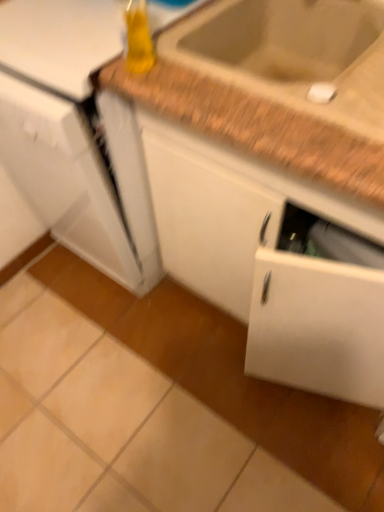
What is the approximate height of white glossy refrigerator at left?

white glossy refrigerator at left is 33.90 inches tall.

Describe the element at coordinates (76, 137) in the screenshot. I see `white glossy refrigerator at left` at that location.

The image size is (384, 512). What are the coordinates of `white glossy refrigerator at left` in the screenshot? It's located at (76, 137).

The width and height of the screenshot is (384, 512). What are the coordinates of `cabinetry located below the translucent yellow bottle at upper center (from the image's perspective)` in the screenshot? It's located at (268, 265).

Can you confirm if translucent yellow bottle at upper center is shorter than white matte cabinet at center?

Yes.

Is there a large distance between translucent yellow bottle at upper center and white matte cabinet at center?

No, there isn't a large distance between translucent yellow bottle at upper center and white matte cabinet at center.

Is brown speckled granite at upper right wider or thinner than white matte cabinet at center?

brown speckled granite at upper right is thinner than white matte cabinet at center.

Is brown speckled granite at upper right facing towards white matte cabinet at center?

Yes.

What are the coordinates of `cabinetry on the right of brown speckled granite at upper right` in the screenshot? It's located at (268, 265).

Is brown speckled granite at upper right in front of or behind white glossy refrigerator at left in the image?

In the image, brown speckled granite at upper right appears in front of white glossy refrigerator at left.

Which is more to the left, brown speckled granite at upper right or white glossy refrigerator at left?

Positioned to the left is white glossy refrigerator at left.

Does point (265, 5) lie in front of point (40, 179)?

That is True.

Identify the location of countertop that is in front of the white glossy refrigerator at left. (277, 86).

From the image's perspective, does white matte cabinet at center appear higher than translucent yellow bottle at upper center?

No.

From a real-world perspective, who is located higher, white matte cabinet at center or translucent yellow bottle at upper center?

translucent yellow bottle at upper center is physically above.

Looking at this image, does white matte cabinet at center appear on the right side of translucent yellow bottle at upper center?

Correct, you'll find white matte cabinet at center to the right of translucent yellow bottle at upper center.

Does white glossy refrigerator at left have a smaller size compared to brown speckled granite at upper right?

Incorrect, white glossy refrigerator at left is not smaller in size than brown speckled granite at upper right.

Is brown speckled granite at upper right completely or partially inside white glossy refrigerator at left?

Actually, brown speckled granite at upper right is outside white glossy refrigerator at left.

Which point is more distant from viewer, (x=53, y=41) or (x=225, y=70)?

The point (x=53, y=41) is behind.

Looking at this image, between white glossy refrigerator at left and brown speckled granite at upper right, which one is positioned behind?

white glossy refrigerator at left is further away from the camera.

You are a GUI agent. You are given a task and a screenshot of the screen. Output one action in this format:
    pyautogui.click(x=<x>, y=<y>)
    Task: Click on the bottle above the white glossy refrigerator at left (from the image's perspective)
    This screenshot has height=512, width=384.
    Given the screenshot: What is the action you would take?
    pyautogui.click(x=138, y=38)

Which is more to the left, white glossy refrigerator at left or translucent yellow bottle at upper center?

white glossy refrigerator at left.

From the image's perspective, relative to translucent yellow bottle at upper center, is white glossy refrigerator at left above or below?

From the image's perspective, white glossy refrigerator at left appears below translucent yellow bottle at upper center.

From a real-world perspective, which object rests below the other?

white glossy refrigerator at left, from a real-world perspective.

From a real-world perspective, does brown speckled granite at upper right stand above translucent yellow bottle at upper center?

No, from a real-world perspective, brown speckled granite at upper right is not above translucent yellow bottle at upper center.

Considering the positions of points (375, 44) and (136, 28), is point (375, 44) closer to camera compared to point (136, 28)?

No, (375, 44) is behind (136, 28).

Choose the correct answer: Is brown speckled granite at upper right inside translucent yellow bottle at upper center or outside it?

brown speckled granite at upper right is outside translucent yellow bottle at upper center.

The image size is (384, 512). Find the location of `bottle that is on the left side of brown speckled granite at upper right`. bottle that is on the left side of brown speckled granite at upper right is located at coordinates (138, 38).

Find the location of a particular element. Image resolution: width=384 pixels, height=512 pixels. bottle that appears above the white matte cabinet at center (from a real-world perspective) is located at coordinates (138, 38).

Where is `cabinetry in front of the brown speckled granite at upper right`? cabinetry in front of the brown speckled granite at upper right is located at coordinates (268, 265).

Which object lies nearer to the anchor point white matte cabinet at center, white glossy refrigerator at left or translucent yellow bottle at upper center?

white glossy refrigerator at left lies closer to white matte cabinet at center than the other object.

Which object lies further to the anchor point translucent yellow bottle at upper center, white matte cabinet at center or white glossy refrigerator at left?

white matte cabinet at center is positioned further to the anchor translucent yellow bottle at upper center.

Estimate the real-world distances between objects in this image. Which object is closer to brown speckled granite at upper right, white glossy refrigerator at left or white matte cabinet at center?

white matte cabinet at center is closer to brown speckled granite at upper right.

From the image, which object appears to be nearer to brown speckled granite at upper right, white matte cabinet at center or white glossy refrigerator at left?

white matte cabinet at center is closer to brown speckled granite at upper right.

When comparing their distances from brown speckled granite at upper right, does translucent yellow bottle at upper center or white glossy refrigerator at left seem further?

white glossy refrigerator at left.

When comparing their distances from translucent yellow bottle at upper center, does white matte cabinet at center or brown speckled granite at upper right seem closer?

The object closer to translucent yellow bottle at upper center is brown speckled granite at upper right.

Considering their positions, is translucent yellow bottle at upper center positioned further to white glossy refrigerator at left than brown speckled granite at upper right?

Among the two, translucent yellow bottle at upper center is located further to white glossy refrigerator at left.

Based on their spatial positions, is white glossy refrigerator at left or translucent yellow bottle at upper center further from brown speckled granite at upper right?

Based on the image, white glossy refrigerator at left appears to be further to brown speckled granite at upper right.

Find the location of `bottle between white glossy refrigerator at left and white matte cabinet at center from left to right`. bottle between white glossy refrigerator at left and white matte cabinet at center from left to right is located at coordinates (138, 38).

The height and width of the screenshot is (512, 384). In order to click on countertop between translucent yellow bottle at upper center and white matte cabinet at center in this screenshot , I will do `click(277, 86)`.

Identify the location of countertop located between white glossy refrigerator at left and white matte cabinet at center in the left-right direction. The image size is (384, 512). pyautogui.click(x=277, y=86).

Find the location of a particular element. Image resolution: width=384 pixels, height=512 pixels. bottle located between white glossy refrigerator at left and brown speckled granite at upper right in the left-right direction is located at coordinates (138, 38).